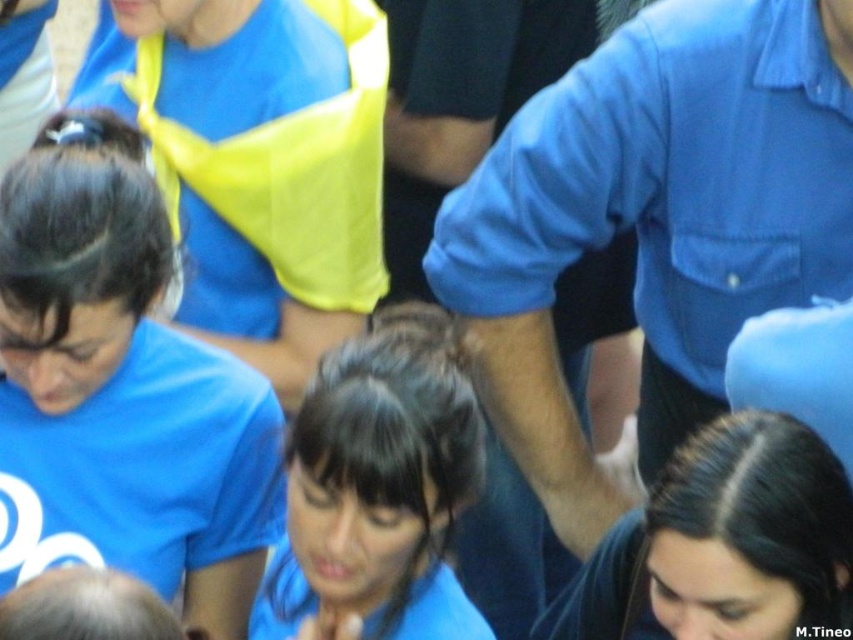
Is blue shirt at upper center in front of dark brown hair at center?

No, it is not.

Which is more to the right, blue shirt at upper center or dark brown hair at center?

blue shirt at upper center

The image size is (853, 640). I want to click on blue shirt at upper center, so click(654, 220).

Consider the image. Does blue matte shirt at center appear on the left side of dark brown hair at center?

Correct, you'll find blue matte shirt at center to the left of dark brown hair at center.

How distant is blue matte shirt at center from dark brown hair at center?

blue matte shirt at center and dark brown hair at center are 3.70 feet apart.

Describe the element at coordinates (120, 394) in the screenshot. I see `blue matte shirt at center` at that location.

At what (x,y) coordinates should I click in order to perform the action: click on blue matte shirt at center. Please return your answer as a coordinate pair (x, y). Looking at the image, I should click on (120, 394).

Who is positioned more to the right, blue shirt at upper center or blue matte shirt at center?

blue shirt at upper center

Can you confirm if blue shirt at upper center is thinner than blue matte shirt at center?

Incorrect, blue shirt at upper center's width is not less than blue matte shirt at center's.

Image resolution: width=853 pixels, height=640 pixels. I want to click on blue shirt at upper center, so click(x=654, y=220).